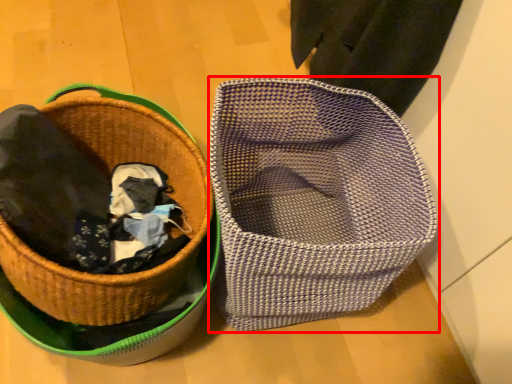
Question: From the image, what is the correct spatial relationship of basket (annotated by the red box) in relation to picnic basket?

Choices:
 (A) right
 (B) left

Answer: (A)